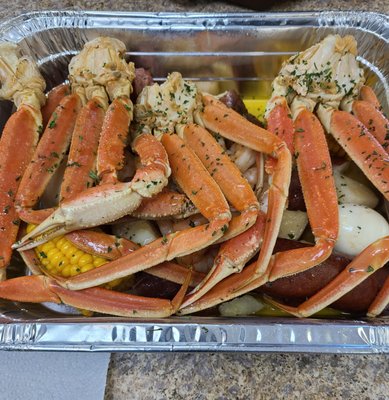
Find the location of `paper towel`. paper towel is located at coordinates (69, 390).